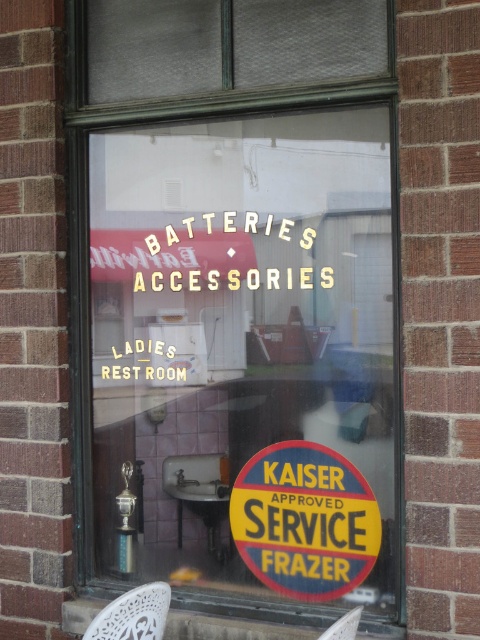
The height and width of the screenshot is (640, 480). Find the location of `yellowmattesign at center`. yellowmattesign at center is located at coordinates (304, 520).

Is point (308, 541) behind point (340, 627)?

Yes, it is behind point (340, 627).

What are the coordinates of `yellowmattesign at center` in the screenshot? It's located at (304, 520).

Does yellowmattesign at center have a greater height compared to white lace chair at lower left?

Indeed, yellowmattesign at center has a greater height compared to white lace chair at lower left.

Between yellowmattesign at center and white lace chair at lower left, which one is positioned higher?

yellowmattesign at center is above.

The height and width of the screenshot is (640, 480). Find the location of `yellowmattesign at center`. yellowmattesign at center is located at coordinates (304, 520).

Can you confirm if white lace chair at lower left is wider than white plastic chair at lower right?

Yes, white lace chair at lower left is wider than white plastic chair at lower right.

Between white lace chair at lower left and white plastic chair at lower right, which one is positioned lower?

white plastic chair at lower right

The width and height of the screenshot is (480, 640). What are the coordinates of `white lace chair at lower left` in the screenshot? It's located at (132, 614).